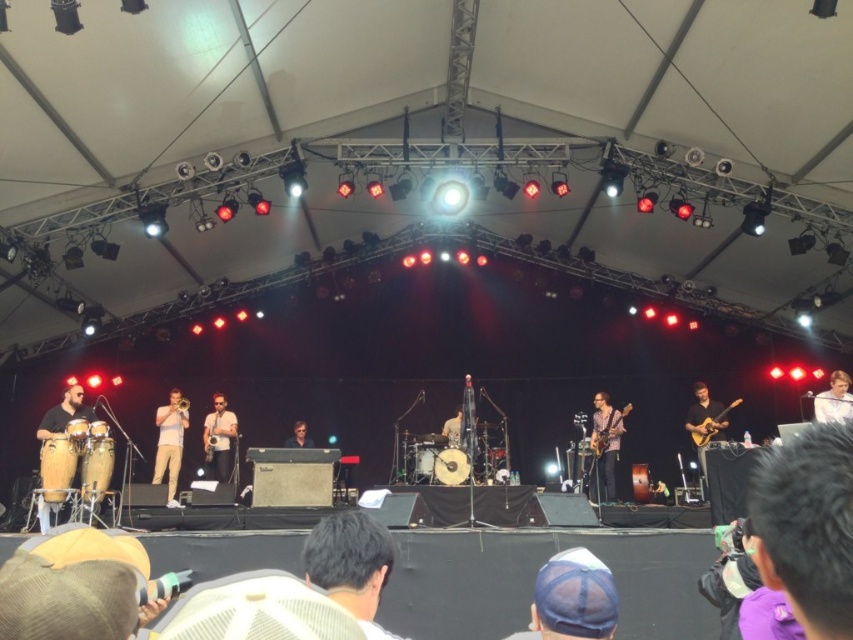
This screenshot has height=640, width=853. Describe the element at coordinates (218, 440) in the screenshot. I see `matte beige saxophone at center` at that location.

Who is positioned more to the right, matte beige saxophone at center or glossy wood guitar at right?

Positioned to the right is glossy wood guitar at right.

Between point (223, 464) and point (706, 433), which one is positioned behind?

Positioned behind is point (223, 464).

This screenshot has height=640, width=853. Identify the location of matte beige saxophone at center. (218, 440).

Who is positioned more to the right, matte beige saxophone at center or wooden electric guitar at center?

wooden electric guitar at center is more to the right.

Is point (221, 470) positioned in front of point (596, 429)?

No, it is behind (596, 429).

Who is more forward, (225, 417) or (610, 433)?

Positioned in front is point (610, 433).

I want to click on matte beige saxophone at center, so click(218, 440).

Can you confirm if dark hair at lower right is smaller than matte brown conga at left?

Indeed, dark hair at lower right has a smaller size compared to matte brown conga at left.

Where is `dark hair at lower right`? The image size is (853, 640). dark hair at lower right is located at coordinates (807, 525).

Between point (850, 508) and point (90, 417), which one is positioned behind?

Positioned behind is point (90, 417).

You are a GUI agent. You are given a task and a screenshot of the screen. Output one action in this format:
    pyautogui.click(x=<x>, y=<y>)
    Task: Click on the dark hair at lower right
    
    Given the screenshot: What is the action you would take?
    pyautogui.click(x=807, y=525)